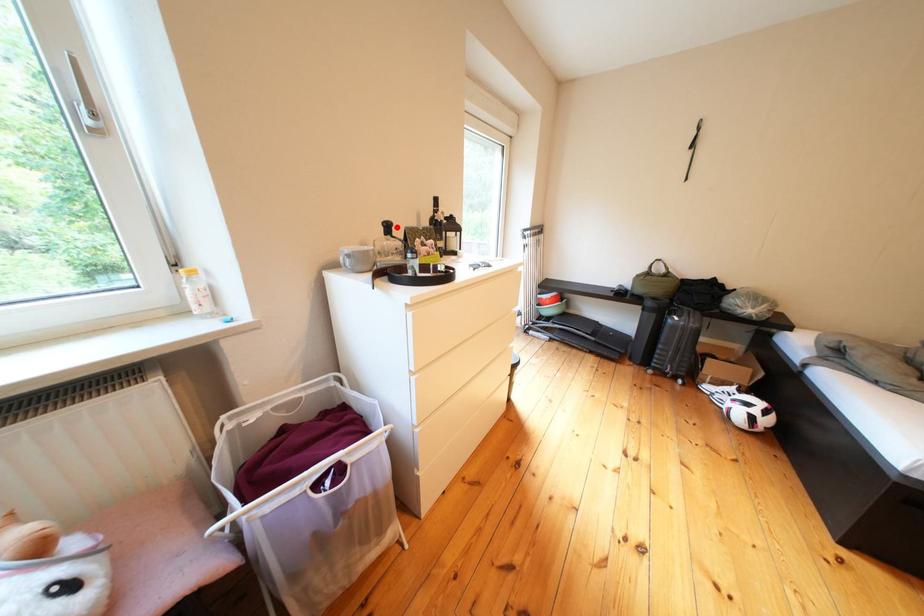
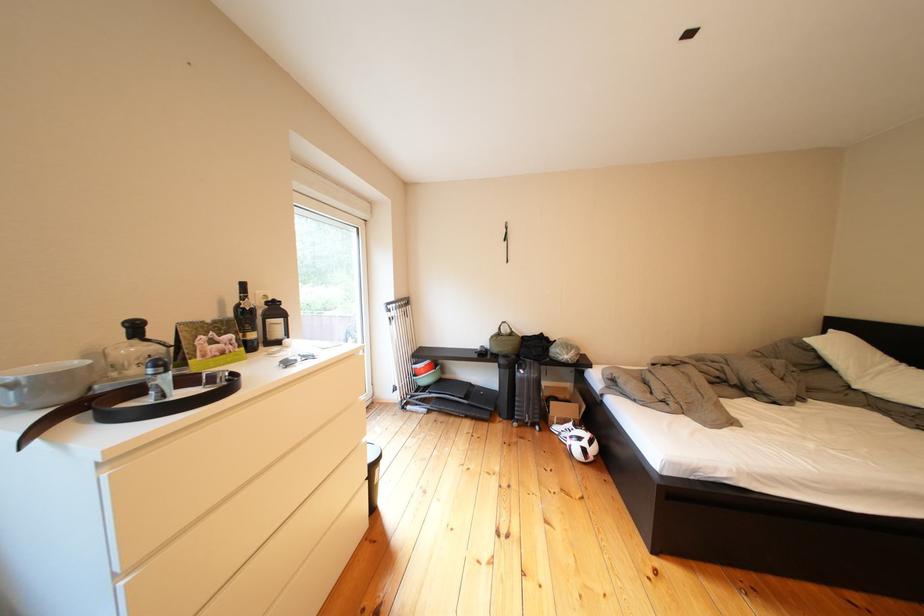
The point at the highlighted location is marked in the first image. Where is the corresponding point in the second image?

(140, 328)